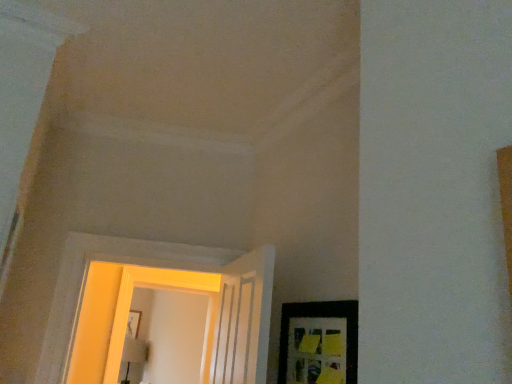
Question: From the image's perspective, relative to matte black picture frame at lower right, is yellow painted wood door at center above or below?

Choices:
 (A) above
 (B) below

Answer: (B)

Question: Is yellow painted wood door at center taller or shorter than matte black picture frame at lower right?

Choices:
 (A) tall
 (B) short

Answer: (A)

Question: In terms of width, does yellow painted wood door at center look wider or thinner when compared to matte black picture frame at lower right?

Choices:
 (A) wide
 (B) thin

Answer: (A)

Question: Which is correct: matte black picture frame at lower right is inside yellow painted wood door at center, or outside of it?

Choices:
 (A) inside
 (B) outside

Answer: (B)

Question: Would you say matte black picture frame at lower right is to the left or to the right of yellow painted wood door at center in the picture?

Choices:
 (A) right
 (B) left

Answer: (A)

Question: Looking at their shapes, would you say matte black picture frame at lower right is wider or thinner than yellow painted wood door at center?

Choices:
 (A) thin
 (B) wide

Answer: (A)

Question: Considering the positions of point (312, 365) and point (117, 347), is point (312, 365) closer or farther from the camera than point (117, 347)?

Choices:
 (A) farther
 (B) closer

Answer: (B)